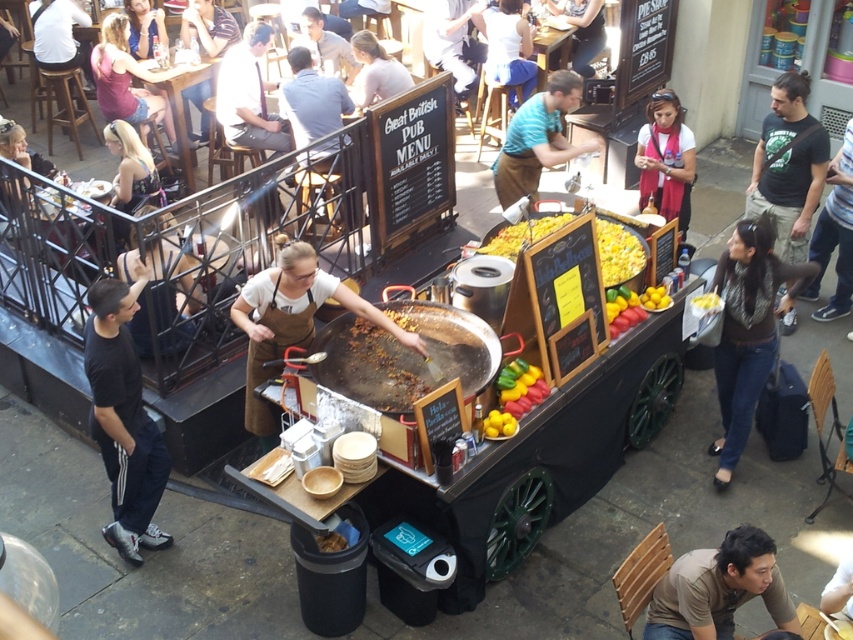
Can you confirm if black cotton t-shirt at right is wider than yellow matte corn at center?

Yes, black cotton t-shirt at right is wider than yellow matte corn at center.

Is black cotton t-shirt at right to the right of yellow matte corn at center from the viewer's perspective?

Correct, you'll find black cotton t-shirt at right to the right of yellow matte corn at center.

Is point (811, 192) closer to camera compared to point (619, 243)?

That is False.

I want to click on black cotton t-shirt at right, so click(788, 164).

Can you confirm if black cotton pants at lower left is taller than glossy plastic lemons at center?

Yes, black cotton pants at lower left is taller than glossy plastic lemons at center.

Which is in front, point (123, 474) or point (515, 362)?

Point (123, 474)

The width and height of the screenshot is (853, 640). Describe the element at coordinates (123, 422) in the screenshot. I see `black cotton pants at lower left` at that location.

The image size is (853, 640). I want to click on black cotton pants at lower left, so click(x=123, y=422).

Is dark brown leather jacket at lower right taller than yellow glossy lemon at center?

Correct, dark brown leather jacket at lower right is much taller as yellow glossy lemon at center.

Does dark brown leather jacket at lower right appear on the right side of yellow glossy lemon at center?

Yes, dark brown leather jacket at lower right is to the right of yellow glossy lemon at center.

Does point (747, 266) come closer to viewer compared to point (704, 314)?

Yes, point (747, 266) is in front of point (704, 314).

I want to click on dark brown leather jacket at lower right, so click(x=747, y=330).